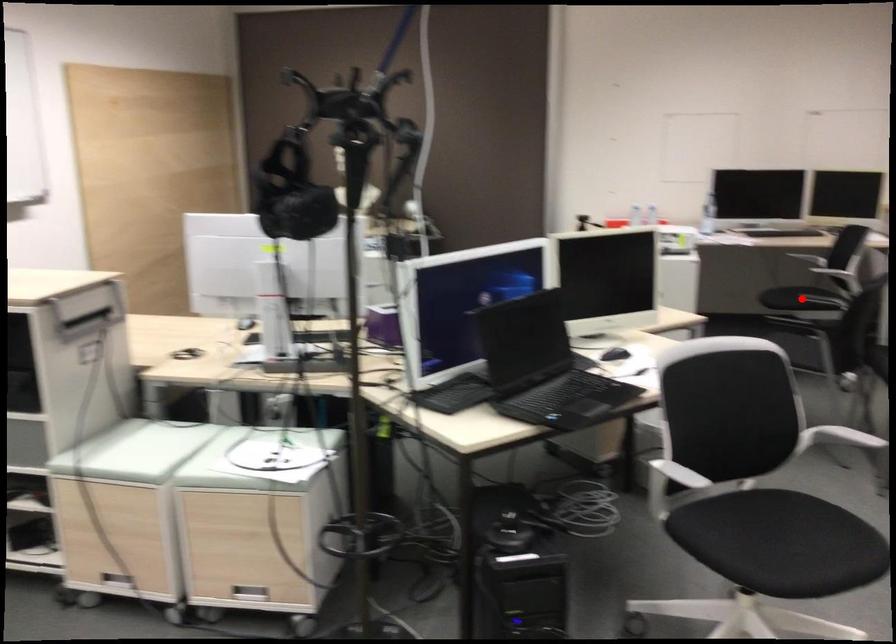
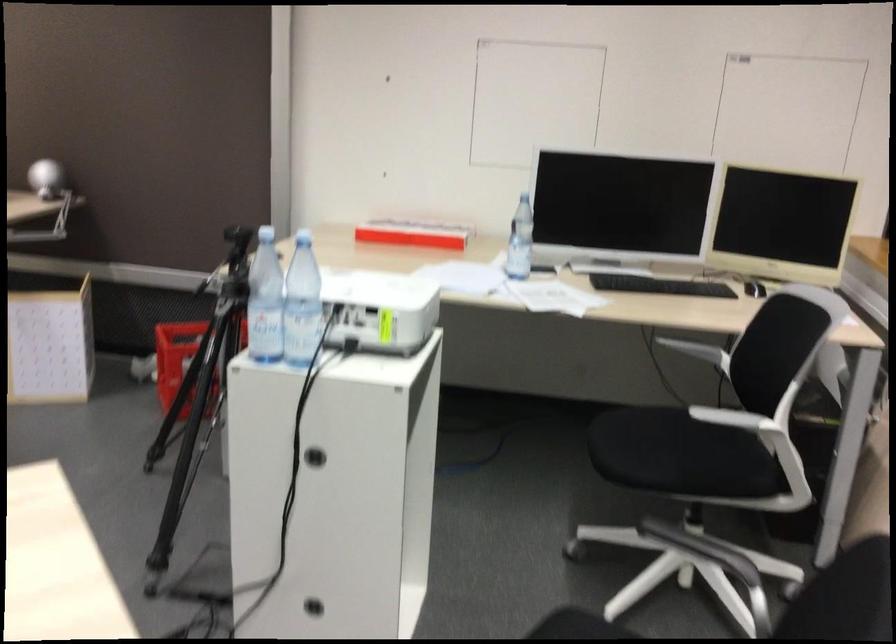
Question: I am providing you with two images of the same scene from different viewpoints. A red point is marked on the first image. At the location where the point appears in image 1, is it still visible in image 2?

Choices:
 (A) Yes
 (B) No

Answer: (B)